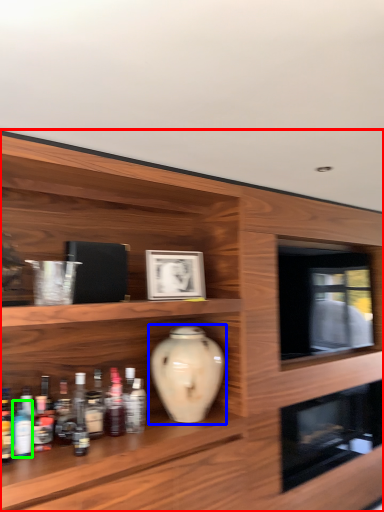
Question: Estimate the real-world distances between objects in this image. Which object is farther from shelf (highlighted by a red box), vase (highlighted by a blue box) or bottle (highlighted by a green box)?

Choices:
 (A) vase
 (B) bottle

Answer: (B)